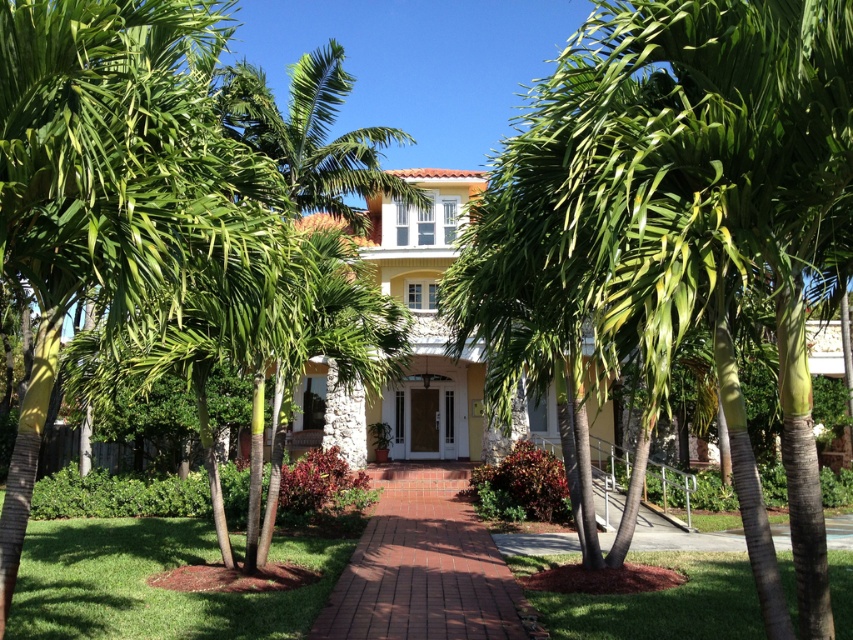
Who is more forward, (194,237) or (498,573)?

Point (194,237) is in front.

Identify the location of green leafy palm tree at left. (107, 179).

Image resolution: width=853 pixels, height=640 pixels. I want to click on green leafy palm tree at left, so pyautogui.click(x=107, y=179).

Does green leafy palm tree at center appear under green leafy palm tree at left?

Actually, green leafy palm tree at center is above green leafy palm tree at left.

Who is more distant from viewer, (608,234) or (67,214)?

The point (67,214) is more distant.

What are the coordinates of `green leafy palm tree at center` in the screenshot? It's located at (674, 221).

Who is lower down, green leafy palm tree at center or brick pathway at center?

brick pathway at center is below.

Between green leafy palm tree at center and brick pathway at center, which one has less height?

brick pathway at center

The height and width of the screenshot is (640, 853). What do you see at coordinates (674, 221) in the screenshot?
I see `green leafy palm tree at center` at bounding box center [674, 221].

Find the location of a particular element. green leafy palm tree at center is located at coordinates (674, 221).